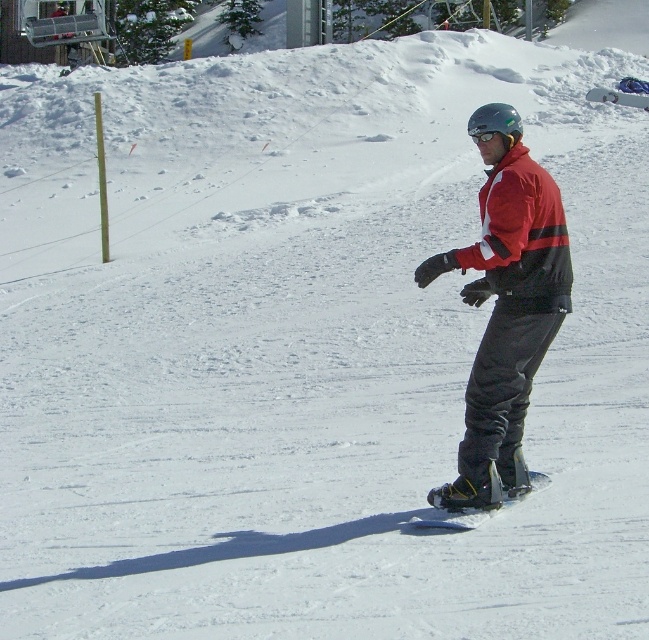
Question: Which of the following is the farthest from the observer?

Choices:
 (A) (541, 484)
 (B) (593, 90)
 (C) (491, 195)

Answer: (B)

Question: Which object is the closest to the red matte jacket at center?

Choices:
 (A) black matte snowboard at center
 (B) matte black snowboard at center

Answer: (A)

Question: Does red matte jacket at center appear on the right side of black matte snowboard at center?

Choices:
 (A) no
 (B) yes

Answer: (B)

Question: Based on their relative distances, which object is nearer to the black matte snowboard at center?

Choices:
 (A) red matte jacket at center
 (B) matte black snowboard at center

Answer: (A)

Question: Does red matte jacket at center lie behind matte black snowboard at center?

Choices:
 (A) yes
 (B) no

Answer: (B)

Question: Can you confirm if red matte jacket at center is smaller than black matte snowboard at center?

Choices:
 (A) yes
 (B) no

Answer: (B)